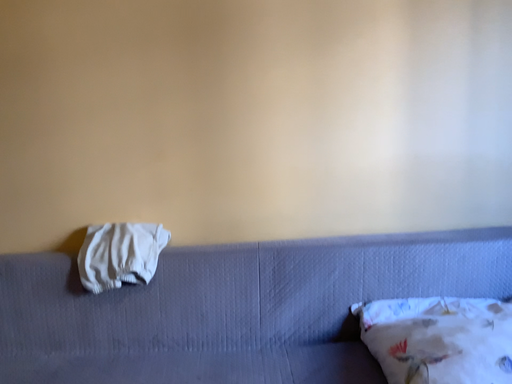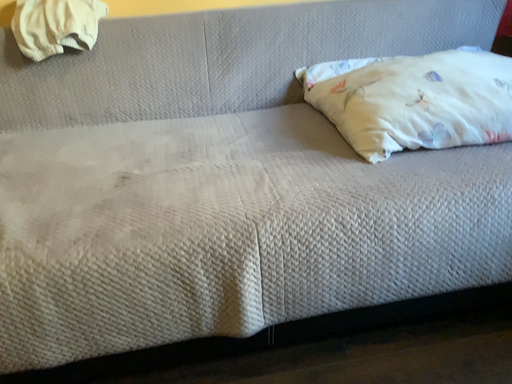
Question: How did the camera likely rotate when shooting the video?

Choices:
 (A) rotated right
 (B) rotated left

Answer: (A)